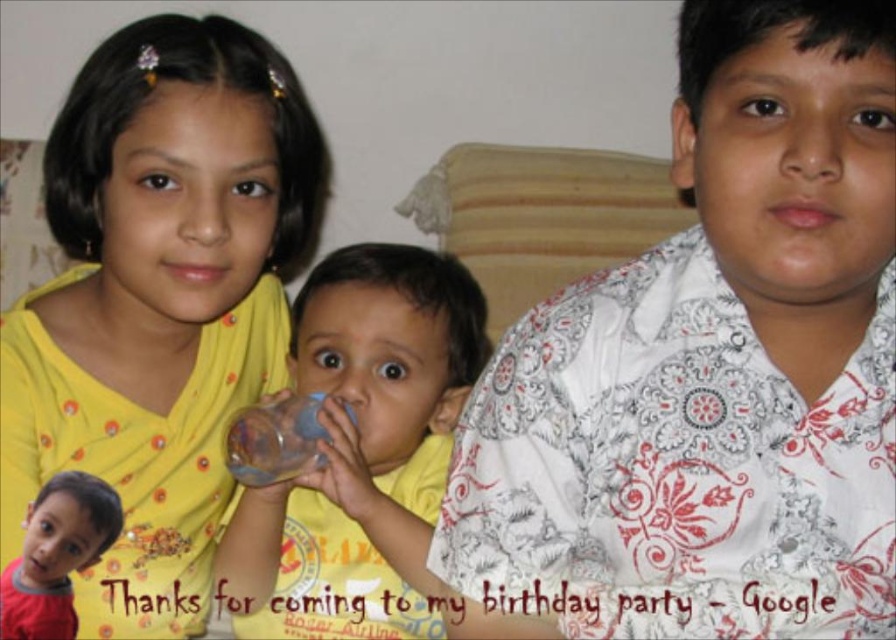
Question: Which of these objects is positioned closest to the red cotton shirt at lower left?

Choices:
 (A) white printed shirt at center
 (B) transparent plastic cup at center
 (C) transparent plastic bottle at center

Answer: (C)

Question: Does yellow fabric at upper left appear under transparent plastic cup at center?

Choices:
 (A) yes
 (B) no

Answer: (B)

Question: Which of the following is the closest to the observer?

Choices:
 (A) transparent plastic bottle at center
 (B) red cotton shirt at lower left
 (C) white printed shirt at center
 (D) yellow fabric at upper left

Answer: (C)

Question: Does yellow fabric at upper left appear on the right side of transparent plastic cup at center?

Choices:
 (A) no
 (B) yes

Answer: (A)

Question: Is yellow fabric at upper left bigger than transparent plastic bottle at center?

Choices:
 (A) yes
 (B) no

Answer: (A)

Question: Considering the real-world distances, which object is closest to the white printed shirt at center?

Choices:
 (A) transparent plastic cup at center
 (B) transparent plastic bottle at center
 (C) red cotton shirt at lower left

Answer: (A)